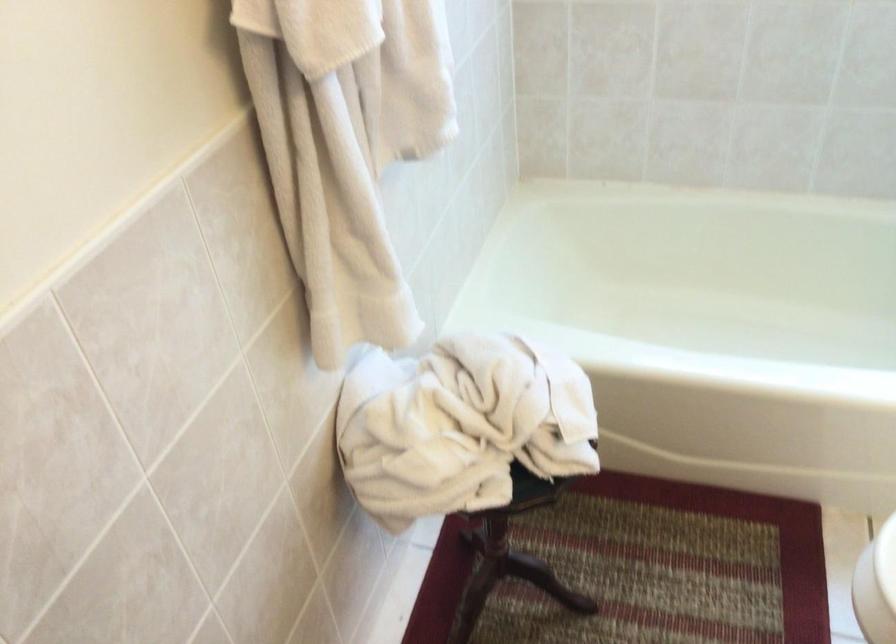
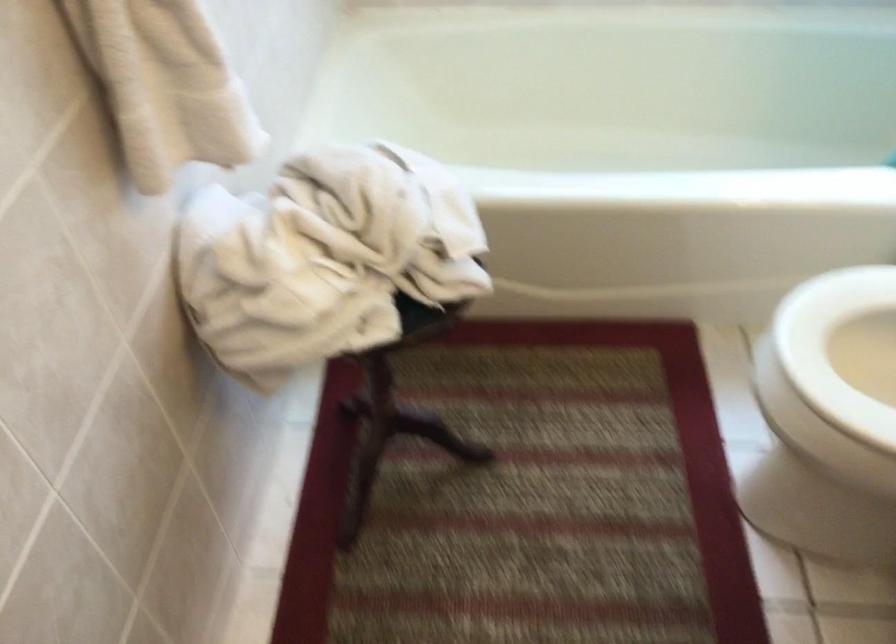
Question: In a continuous first-person perspective shot, in which direction is the camera moving?

Choices:
 (A) Left
 (B) Right
 (C) Forward
 (D) Backward

Answer: (C)